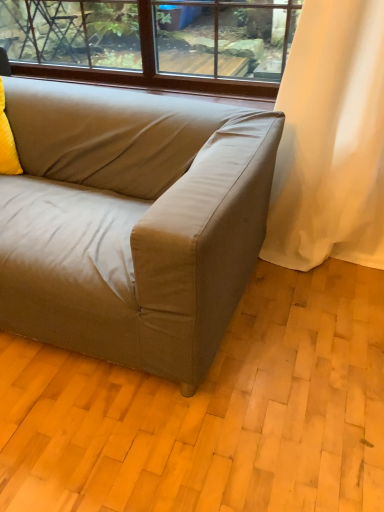
Question: Could you tell me if suede-like beige couch at center is facing yellow fabric pillow at left?

Choices:
 (A) yes
 (B) no

Answer: (A)

Question: Can you confirm if suede-like beige couch at center is positioned to the right of yellow fabric pillow at left?

Choices:
 (A) no
 (B) yes

Answer: (B)

Question: Does suede-like beige couch at center touch yellow fabric pillow at left?

Choices:
 (A) yes
 (B) no

Answer: (B)

Question: From the image's perspective, is suede-like beige couch at center over yellow fabric pillow at left?

Choices:
 (A) no
 (B) yes

Answer: (A)

Question: Is suede-like beige couch at center positioned far away from yellow fabric pillow at left?

Choices:
 (A) yes
 (B) no

Answer: (B)

Question: Is suede-like beige couch at center positioned in front of yellow fabric pillow at left?

Choices:
 (A) no
 (B) yes

Answer: (B)

Question: Is yellow fabric pillow at left further to the viewer compared to suede-like beige couch at center?

Choices:
 (A) no
 (B) yes

Answer: (B)

Question: Is yellow fabric pillow at left thinner than suede-like beige couch at center?

Choices:
 (A) no
 (B) yes

Answer: (B)

Question: Is yellow fabric pillow at left facing towards suede-like beige couch at center?

Choices:
 (A) yes
 (B) no

Answer: (A)

Question: Does yellow fabric pillow at left appear on the right side of suede-like beige couch at center?

Choices:
 (A) no
 (B) yes

Answer: (A)

Question: Does yellow fabric pillow at left contain suede-like beige couch at center?

Choices:
 (A) yes
 (B) no

Answer: (B)

Question: Considering the relative sizes of yellow fabric pillow at left and suede-like beige couch at center in the image provided, is yellow fabric pillow at left bigger than suede-like beige couch at center?

Choices:
 (A) yes
 (B) no

Answer: (B)

Question: Looking at their shapes, would you say suede-like beige couch at center is wider or thinner than yellow fabric pillow at left?

Choices:
 (A) thin
 (B) wide

Answer: (B)